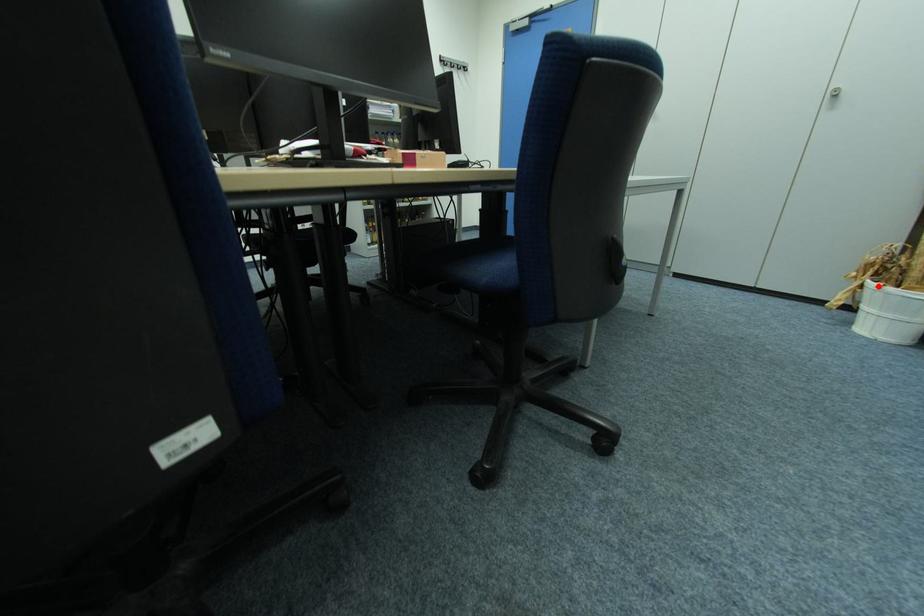
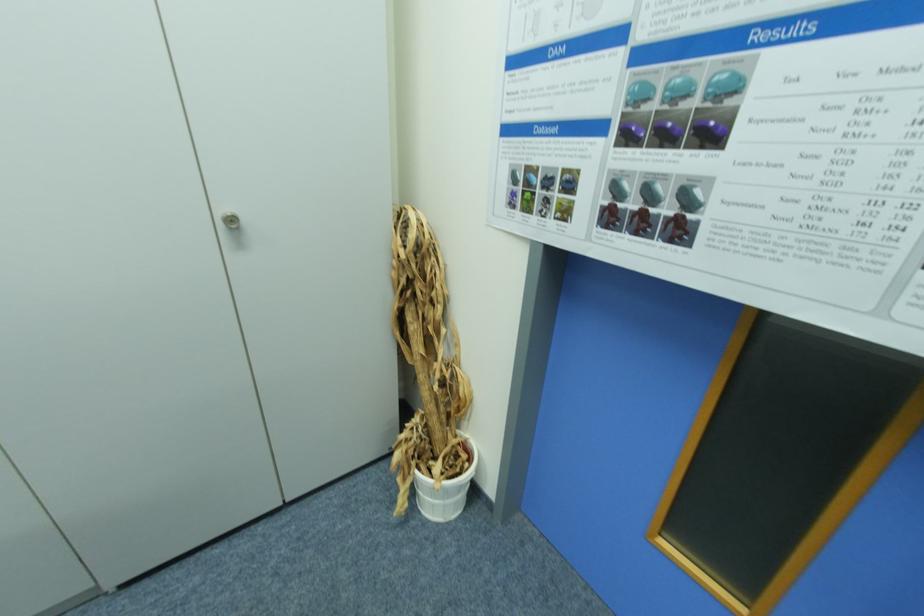
In the second image, find the point that corresponds to the highlighted location in the first image.

(430, 477)